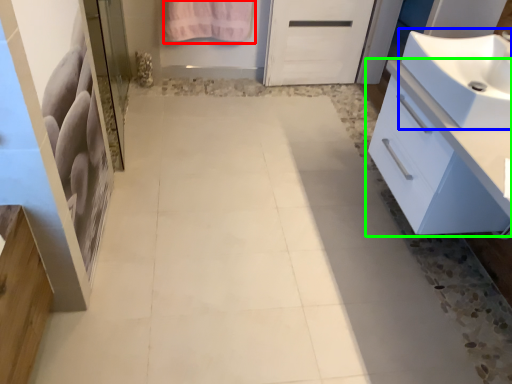
Question: Which is nearer to the bath towel (highlighted by a red box)? sink (highlighted by a blue box) or bathroom cabinet (highlighted by a green box).

Choices:
 (A) sink
 (B) bathroom cabinet

Answer: (A)